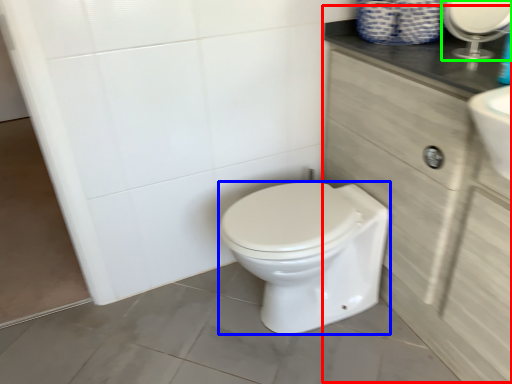
Question: Which is farther away from cabinetry (highlighted by a red box)? bidet (highlighted by a blue box) or mirror (highlighted by a green box)?

Choices:
 (A) bidet
 (B) mirror

Answer: (B)